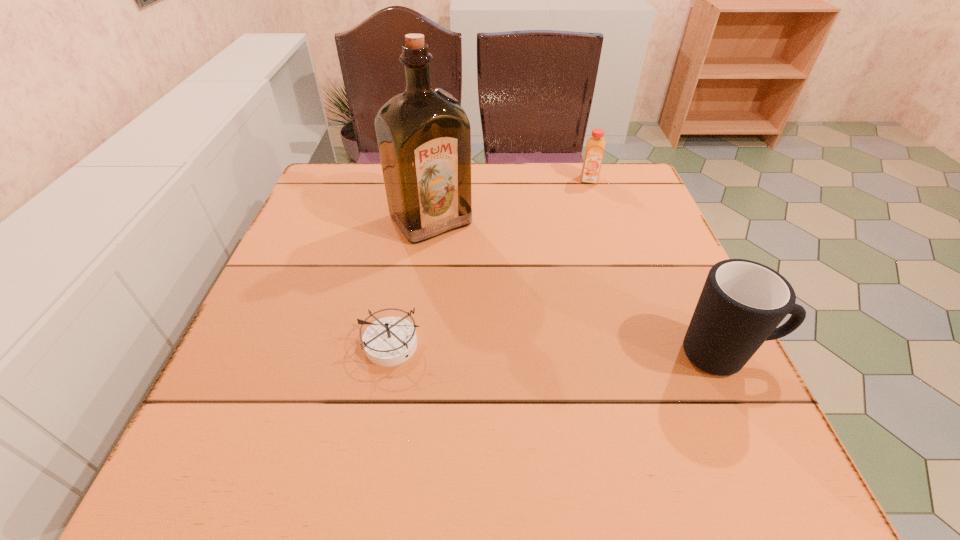
Find the location of a particular element. This screenshot has height=540, width=960. free space on the desktop that is between the compass and the rightmost object and is positioned on the label of the liquor is located at coordinates [x=539, y=349].

Locate an element on the screen. The width and height of the screenshot is (960, 540). vacant space on the desktop that is between the compass and the mug and is positioned on the front and back of the second shortest object is located at coordinates (600, 351).